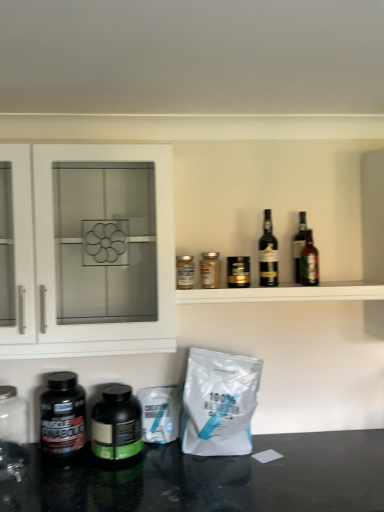
What do you see at coordinates (55, 269) in the screenshot? I see `white glossy cabinet at upper left` at bounding box center [55, 269].

Image resolution: width=384 pixels, height=512 pixels. What do you see at coordinates (62, 416) in the screenshot?
I see `black plastic bottle at lower left, arranged as the 7th bottle when viewed from the right` at bounding box center [62, 416].

What are the coordinates of `black plastic bottle at lower left, arranged as the 7th bottle when viewed from the right` in the screenshot? It's located at (62, 416).

At what (x,y) coordinates should I click in order to perform the action: click on gold metallic can at center. Please return your answer as a coordinate pair (x, y). Image resolution: width=384 pixels, height=512 pixels. Looking at the image, I should click on (238, 272).

Identify the location of clear glass bottles at upper center. The image size is (384, 512). (285, 293).

Describe the element at coordinates (309, 262) in the screenshot. I see `brown glass bottle at upper right, placed as the 1th bottle when sorted from right to left` at that location.

This screenshot has height=512, width=384. Find the location of `white glossy cabinet at upper left`. white glossy cabinet at upper left is located at coordinates (55, 269).

Which is in front, point (300, 225) or point (158, 162)?

The point (158, 162) is closer to the camera.

Is green glass bottle at upper right, which is counted as the 6th bottle, starting from the left, turned away from white glossy cabinet at upper left?

No, green glass bottle at upper right, which is counted as the 6th bottle, starting from the left,'s orientation is not away from white glossy cabinet at upper left.

Is green glass bottle at upper right, which appears as the second bottle when viewed from the right, next to white glossy cabinet at upper left?

No, green glass bottle at upper right, which appears as the second bottle when viewed from the right, is not in contact with white glossy cabinet at upper left.

From their relative heights in the image, would you say transparent glass jar at lower left is taller or shorter than gold metallic can at center?

Clearly, transparent glass jar at lower left is taller compared to gold metallic can at center.

From the image's perspective, is transparent glass jar at lower left located above gold metallic can at center?

No, from the image's perspective, transparent glass jar at lower left is not above gold metallic can at center.

From a real-world perspective, is transparent glass jar at lower left located beneath gold metallic can at center?

Indeed, from a real-world perspective, transparent glass jar at lower left is positioned beneath gold metallic can at center.

In order to click on glass jar below the gold metallic can at center (from the image's perspective) in this screenshot , I will do `click(13, 416)`.

Based on the photo, between white matte bag at lower center and dark glass bottle at upper right, the fifth bottle in the left-to-right sequence, which one has less height?

dark glass bottle at upper right, the fifth bottle in the left-to-right sequence, is shorter.

Is point (221, 356) closer to camera compared to point (263, 262)?

Yes, it is in front of point (263, 262).

Would you say white matte bag at lower center is inside or outside dark glass bottle at upper right, the fifth bottle in the left-to-right sequence?

white matte bag at lower center is outside dark glass bottle at upper right, the fifth bottle in the left-to-right sequence.

How different are the orientations of white matte bag at lower center and dark glass bottle at upper right, the fifth bottle in the left-to-right sequence, in degrees?

2.34 degrees.

From the image's perspective, between brown glass bottle at upper right, arranged as the seventh bottle when viewed from the left, and clear glass bottles at upper center, who is located below?

clear glass bottles at upper center appears lower in the image.

Is the surface of brown glass bottle at upper right, placed as the 1th bottle when sorted from right to left, in direct contact with clear glass bottles at upper center?

There is a gap between brown glass bottle at upper right, placed as the 1th bottle when sorted from right to left, and clear glass bottles at upper center.

Which object is further away from the camera, brown glass bottle at upper right, placed as the 1th bottle when sorted from right to left, or clear glass bottles at upper center?

brown glass bottle at upper right, placed as the 1th bottle when sorted from right to left, is more distant.

Does brown glass bottle at upper right, placed as the 1th bottle when sorted from right to left, have a greater height compared to clear glass bottles at upper center?

Indeed, brown glass bottle at upper right, placed as the 1th bottle when sorted from right to left, has a greater height compared to clear glass bottles at upper center.

Does point (47, 405) come behind point (176, 343)?

No.

Is white glossy cabinet at upper left completely or partially inside black plastic bottle at lower left, which is the 1th bottle in left-to-right order?

Actually, white glossy cabinet at upper left is outside black plastic bottle at lower left, which is the 1th bottle in left-to-right order.

Between black plastic bottle at lower left, which is the 1th bottle in left-to-right order, and white glossy cabinet at upper left, which one is positioned behind?

black plastic bottle at lower left, which is the 1th bottle in left-to-right order.

From a real-world perspective, which is physically above, black plastic bottle at lower left, which is the 1th bottle in left-to-right order, or white glossy cabinet at upper left?

white glossy cabinet at upper left is physically above.

Can you confirm if transparent glass jar at lower left is taller than metallic gold jar at upper center, the 4th bottle from the right?

Correct, transparent glass jar at lower left is much taller as metallic gold jar at upper center, the 4th bottle from the right.

From the image's perspective, between transparent glass jar at lower left and metallic gold jar at upper center, the fourth bottle in the left-to-right sequence, which one is located above?

From the image's view, metallic gold jar at upper center, the fourth bottle in the left-to-right sequence, is above.

Is transparent glass jar at lower left behind metallic gold jar at upper center, the 4th bottle from the right?

No, it is in front of metallic gold jar at upper center, the 4th bottle from the right.

From a real-world perspective, is transparent glass jar at lower left physically above metallic gold jar at upper center, the fourth bottle in the left-to-right sequence?

Actually, transparent glass jar at lower left is physically below metallic gold jar at upper center, the fourth bottle in the left-to-right sequence, in the real world.

Could dark glass bottle at upper right, the fifth bottle in the left-to-right sequence, be considered to be inside gold metallic can at center?

No, dark glass bottle at upper right, the fifth bottle in the left-to-right sequence, is not a part of gold metallic can at center.

Between gold metallic can at center and dark glass bottle at upper right, the third bottle in the right-to-left sequence, which one is positioned behind?

dark glass bottle at upper right, the third bottle in the right-to-left sequence, is more distant.

From a real-world perspective, is gold metallic can at center on dark glass bottle at upper right, the third bottle in the right-to-left sequence?

No, from a real-world perspective, gold metallic can at center is not over dark glass bottle at upper right, the third bottle in the right-to-left sequence

Considering the sizes of objects gold metallic can at center and dark glass bottle at upper right, the fifth bottle in the left-to-right sequence, in the image provided, who is shorter, gold metallic can at center or dark glass bottle at upper right, the fifth bottle in the left-to-right sequence,?

gold metallic can at center is shorter.

At what (x,y) coordinates should I click in order to perform the action: click on cabinetry that appears on the left of green glass bottle at upper right, which appears as the second bottle when viewed from the right. Please return your answer as a coordinate pair (x, y). The width and height of the screenshot is (384, 512). Looking at the image, I should click on (55, 269).

You are a GUI agent. You are given a task and a screenshot of the screen. Output one action in this format:
    pyautogui.click(x=<x>, y=<y>)
    Task: Click on the beverage that is above the transparent glass jar at lower left (from the image's perspective)
    This screenshot has width=384, height=512.
    Given the screenshot: What is the action you would take?
    pyautogui.click(x=238, y=272)

From the image, which object appears to be nearer to brown glass bottle at upper right, arranged as the seventh bottle when viewed from the left, white glossy cabinet at upper left or transparent glass jar at lower left?

white glossy cabinet at upper left is positioned closer to the anchor brown glass bottle at upper right, arranged as the seventh bottle when viewed from the left.

Looking at this image, from the image, which object appears to be nearer to white matte bag at lower center, metallic gold jar at upper center, the fourth bottle in the left-to-right sequence, or gold metallic can at center?

Among the two, metallic gold jar at upper center, the fourth bottle in the left-to-right sequence, is located nearer to white matte bag at lower center.

When comparing their distances from transparent glass jar at lower left, does dark glass bottle at upper right, the third bottle in the right-to-left sequence, or white matte bag at lower center seem further?

dark glass bottle at upper right, the third bottle in the right-to-left sequence, is positioned further to the anchor transparent glass jar at lower left.

Consider the image. Based on their spatial positions, is brown glass bottle at upper right, arranged as the seventh bottle when viewed from the left, or matte glass jar at center, the 3th bottle positioned from the left, further from black matte bottle at lower center, the second bottle viewed from the left?

The object further to black matte bottle at lower center, the second bottle viewed from the left, is brown glass bottle at upper right, arranged as the seventh bottle when viewed from the left.

Estimate the real-world distances between objects in this image. Which object is further from metallic gold jar at upper center, the fourth bottle in the left-to-right sequence, black matte bottle at lower center, which ranks as the 6th bottle in right-to-left order, or dark glass bottle at upper right, the fifth bottle in the left-to-right sequence?

black matte bottle at lower center, which ranks as the 6th bottle in right-to-left order, is further to metallic gold jar at upper center, the fourth bottle in the left-to-right sequence.

From the picture: Looking at the image, which one is located closer to black plastic bottle at lower left, which is the 1th bottle in left-to-right order, clear glass bottles at upper center or transparent glass jar at lower left?

The object closer to black plastic bottle at lower left, which is the 1th bottle in left-to-right order, is transparent glass jar at lower left.

From the image, which object appears to be farther from metallic gold jar at upper center, the 4th bottle from the right, black matte bottle at lower center, the second bottle viewed from the left, or matte glass jar at center, the fifth bottle from the right?

black matte bottle at lower center, the second bottle viewed from the left, is further to metallic gold jar at upper center, the 4th bottle from the right.

Estimate the real-world distances between objects in this image. Which object is further from transparent glass jar at lower left, clear glass bottles at upper center or green glass bottle at upper right, which appears as the second bottle when viewed from the right?

Among the two, green glass bottle at upper right, which appears as the second bottle when viewed from the right, is located further to transparent glass jar at lower left.

Where is `material between black plastic bottle at lower left, which is the 1th bottle in left-to-right order, and gold metallic can at center`? This screenshot has height=512, width=384. material between black plastic bottle at lower left, which is the 1th bottle in left-to-right order, and gold metallic can at center is located at coordinates (219, 403).

Image resolution: width=384 pixels, height=512 pixels. What are the coordinates of `bottle between metallic gold jar at upper center, the 4th bottle from the right, and green glass bottle at upper right, which is counted as the 6th bottle, starting from the left, in the horizontal direction` in the screenshot? It's located at pyautogui.click(x=268, y=254).

You are a GUI agent. You are given a task and a screenshot of the screen. Output one action in this format:
    pyautogui.click(x=<x>, y=<y>)
    Task: Click on the bottle between matte glass jar at center, the 3th bottle positioned from the left, and black matte bottle at lower center, the second bottle viewed from the left, in the vertical direction
    
    Given the screenshot: What is the action you would take?
    pyautogui.click(x=62, y=416)

Identify the location of material between gold metallic can at center and black matte bottle at lower center, the second bottle viewed from the left, from top to bottom. (219, 403).